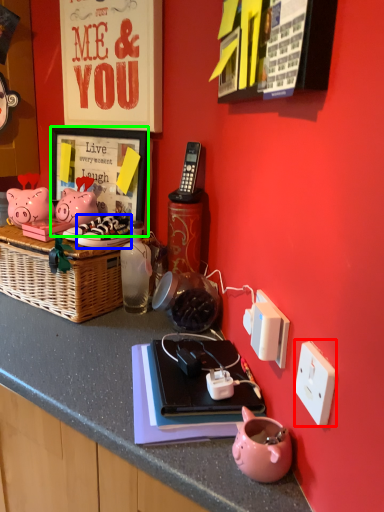
Question: Which object is positioned closest to power outlet (highlighted by a red box)? Select from footwear (highlighted by a blue box) and picture frame (highlighted by a green box).

Choices:
 (A) footwear
 (B) picture frame

Answer: (A)